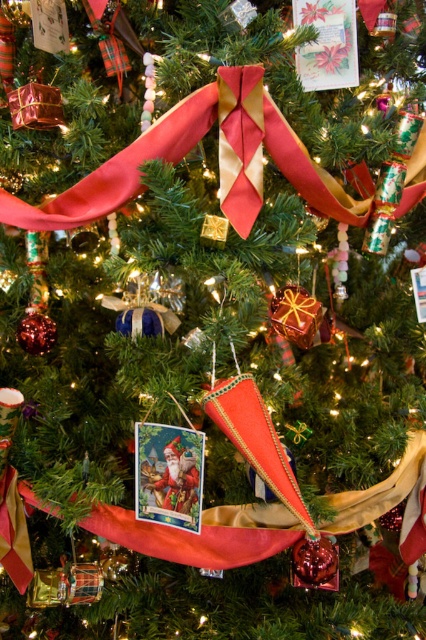
Question: Is silky red ribbon at center bigger than matte paper card at upper center?

Choices:
 (A) yes
 (B) no

Answer: (A)

Question: Estimate the real-world distances between objects in this image. Which object is closer to the silky red ribbon at center?

Choices:
 (A) matte paper card at upper center
 (B) matte paper card at center

Answer: (A)

Question: Can you confirm if silky red ribbon at center is positioned above matte paper card at center?

Choices:
 (A) no
 (B) yes

Answer: (B)

Question: Which object appears farthest from the camera in this image?

Choices:
 (A) matte paper card at center
 (B) matte paper card at upper center
 (C) silky red ribbon at center

Answer: (B)

Question: Does silky red ribbon at center come in front of matte paper card at center?

Choices:
 (A) yes
 (B) no

Answer: (A)

Question: Estimate the real-world distances between objects in this image. Which object is closer to the matte paper card at upper center?

Choices:
 (A) silky red ribbon at center
 (B) matte paper card at center

Answer: (A)